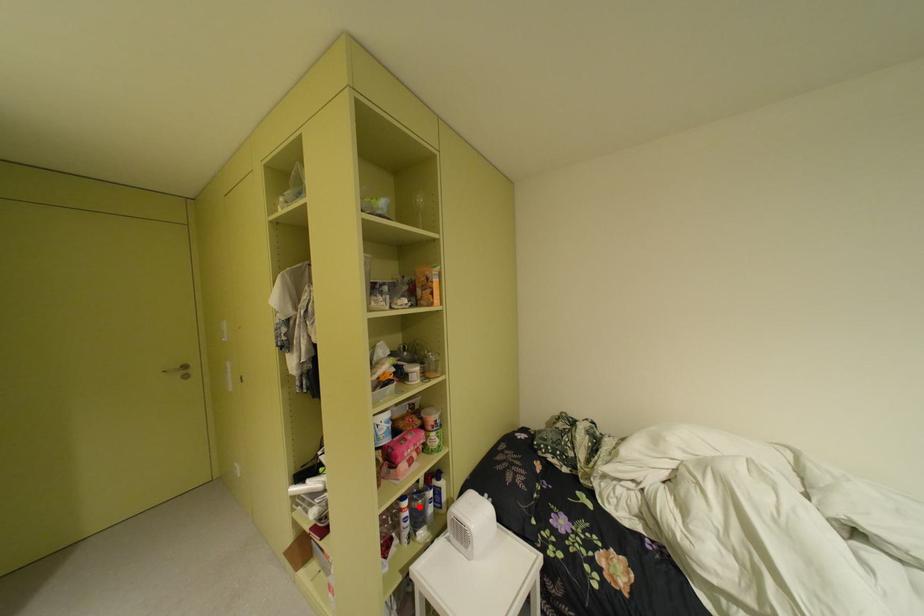
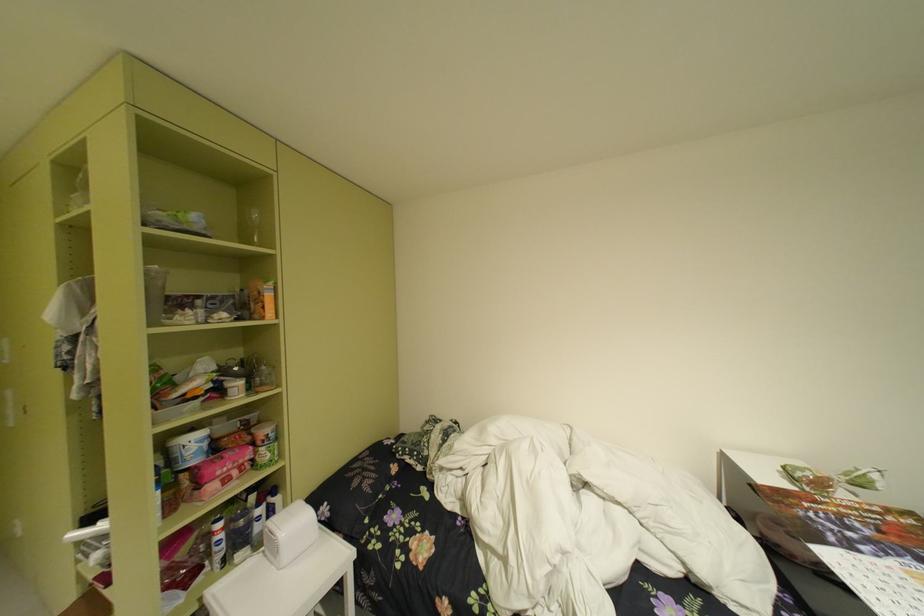
In the second image, find the point that corresponds to the highlighted location in the first image.

(235, 528)